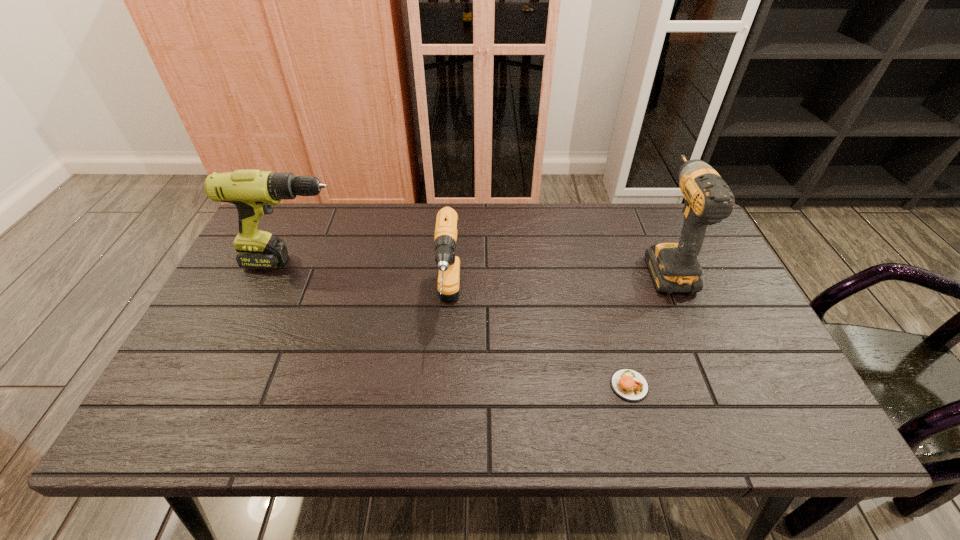
The image size is (960, 540). What are the coordinates of `the rightmost object` in the screenshot? It's located at (674, 267).

You are a GUI agent. You are given a task and a screenshot of the screen. Output one action in this format:
    pyautogui.click(x=<x>, y=<y>)
    Task: Click on the leftmost object
    The width and height of the screenshot is (960, 540).
    Given the screenshot: What is the action you would take?
    pyautogui.click(x=253, y=192)

Locate an element on the screen. Image resolution: width=960 pixels, height=540 pixels. the second shortest object is located at coordinates (445, 236).

Find the location of a particular element. The height and width of the screenshot is (540, 960). the shortest drill is located at coordinates (445, 236).

Locate an element on the screen. The width and height of the screenshot is (960, 540). the shortest object is located at coordinates (630, 385).

This screenshot has height=540, width=960. What are the coordinates of `the nearest object` in the screenshot? It's located at (630, 385).

Image resolution: width=960 pixels, height=540 pixels. I want to click on vacant space situated 0.060m with the drill bit of the rightmost drill facing forward, so click(648, 224).

Locate an element on the screen. Image resolution: width=960 pixels, height=540 pixels. blank space located 0.280m on the handle side of the leftmost object is located at coordinates (444, 262).

Identify the location of vacant position located at the tip of the second shortest object. The height and width of the screenshot is (540, 960). (440, 432).

Locate an element on the screen. The width and height of the screenshot is (960, 540). vacant space positioned 0.350m on the left of the patty is located at coordinates (456, 386).